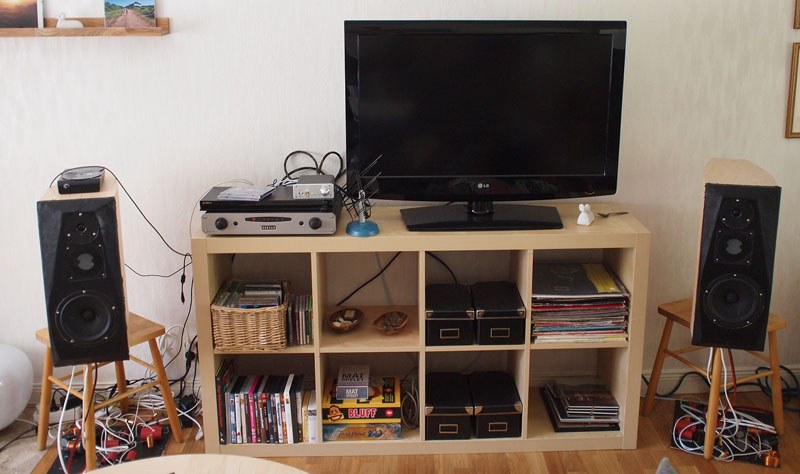
Locate an element on the screen. stereo speakers is located at coordinates (718, 273), (78, 274).